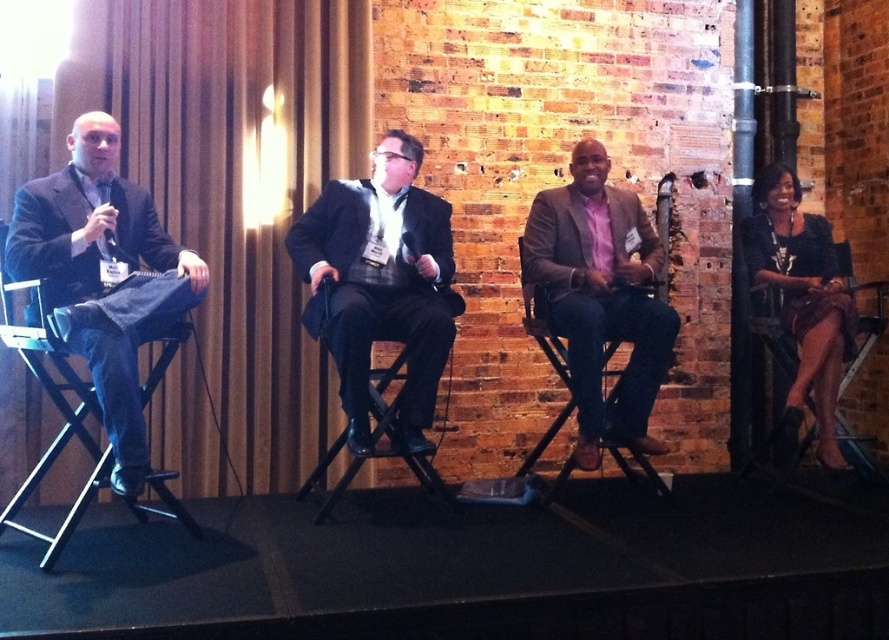
You are attending a panel discussion and need to adjust your seating. You have a preference for a chair that is taller. Based on the scene, which chair between the black leather chair at right and the black leather chair at center should you choose?

The black leather chair at right is much taller than the black leather chair at center, so you should choose the black leather chair at right.

Consider the image. You are a stagehand who needs to place a 5.5 feet long extension cord between the black leather chair at right and the black leather chair at center. Will the cord be long enough to reach both chairs without bending it?

The black leather chair at right and black leather chair at center are 6.14 feet apart. The 5.5 feet long extension cord is shorter than the distance between the chairs, so it will not be long enough to reach both chairs without bending it.

You are an attendee sitting in the audience and want to ask a question to the person in the matte black suit at left. To whom should you direct your question if the person in the pink matte shirt at center is blocking your view?

You should direct your question to the matte black suit at left because they are in front of the pink matte shirt at center, so the matte black suit at left is closer to you.